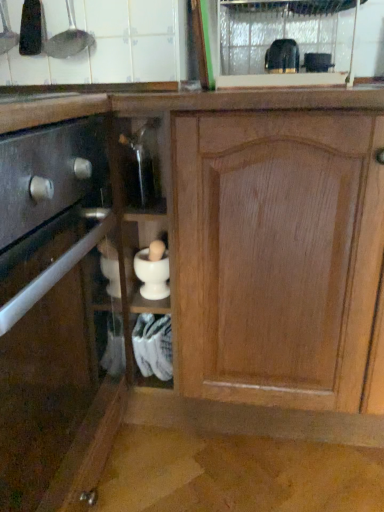
Question: Which direction should I rotate to look at black plastic toaster at upper center, the 5th appliance when ordered from left to right?

Choices:
 (A) right
 (B) left

Answer: (A)

Question: Is metallic spoon at upper left, marked as the second appliance in a left-to-right arrangement, oriented towards matte black drawer at left, acting as the 2th cabinetry starting from the right?

Choices:
 (A) yes
 (B) no

Answer: (B)

Question: Can you confirm if metallic spoon at upper left, which ranks as the 5th appliance in right-to-left order, is wider than matte black drawer at left, acting as the 2th cabinetry starting from the right?

Choices:
 (A) yes
 (B) no

Answer: (B)

Question: Is metallic spoon at upper left, which ranks as the 5th appliance in right-to-left order, not close to matte black drawer at left, acting as the 2th cabinetry starting from the right?

Choices:
 (A) yes
 (B) no

Answer: (B)

Question: From the image's perspective, is metallic spoon at upper left, marked as the second appliance in a left-to-right arrangement, under matte black drawer at left, acting as the 2th cabinetry starting from the right?

Choices:
 (A) yes
 (B) no

Answer: (B)

Question: From a real-world perspective, is metallic spoon at upper left, marked as the second appliance in a left-to-right arrangement, located higher than matte black drawer at left, acting as the 2th cabinetry starting from the right?

Choices:
 (A) yes
 (B) no

Answer: (A)

Question: Can you confirm if metallic spoon at upper left, which ranks as the 5th appliance in right-to-left order, is thinner than matte black drawer at left, the 1th cabinetry when ordered from left to right?

Choices:
 (A) yes
 (B) no

Answer: (A)

Question: Is wooden cabinet at center, the first cabinetry in the right-to-left sequence, closer to the viewer compared to black plastic toaster at upper center, positioned as the 2th appliance in right-to-left order?

Choices:
 (A) no
 (B) yes

Answer: (B)

Question: Can you confirm if wooden cabinet at center, which is the second cabinetry in left-to-right order, is smaller than black plastic toaster at upper center, the 5th appliance when ordered from left to right?

Choices:
 (A) yes
 (B) no

Answer: (B)

Question: From the image's perspective, does wooden cabinet at center, which is the second cabinetry in left-to-right order, appear lower than black plastic toaster at upper center, positioned as the 2th appliance in right-to-left order?

Choices:
 (A) no
 (B) yes

Answer: (B)

Question: Would you say wooden cabinet at center, the first cabinetry in the right-to-left sequence, contains black plastic toaster at upper center, the 5th appliance when ordered from left to right?

Choices:
 (A) no
 (B) yes

Answer: (A)

Question: Is wooden cabinet at center, the first cabinetry in the right-to-left sequence, shorter than black plastic toaster at upper center, positioned as the 2th appliance in right-to-left order?

Choices:
 (A) yes
 (B) no

Answer: (B)

Question: Does wooden cabinet at center, the first cabinetry in the right-to-left sequence, have a greater width compared to black plastic toaster at upper center, positioned as the 2th appliance in right-to-left order?

Choices:
 (A) yes
 (B) no

Answer: (A)

Question: Does matte black drawer at left, acting as the 2th cabinetry starting from the right, come in front of black plastic toaster at upper center, positioned as the 2th appliance in right-to-left order?

Choices:
 (A) no
 (B) yes

Answer: (B)